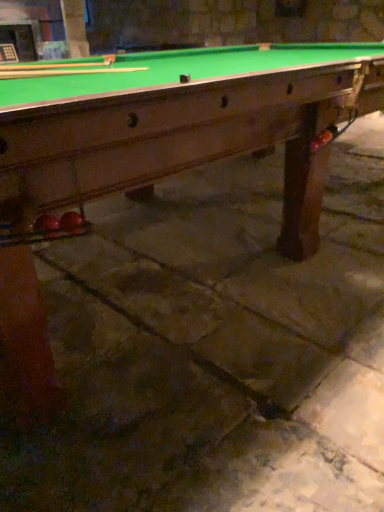
The width and height of the screenshot is (384, 512). Describe the element at coordinates (62, 71) in the screenshot. I see `wooden cue at upper left, which is counted as the 1th cue, starting from the back` at that location.

How much space does wooden cue at upper left, which is counted as the 1th cue, starting from the back, occupy horizontally?

The width of wooden cue at upper left, which is counted as the 1th cue, starting from the back, is 68.19 centimeters.

Locate an element on the screen. The image size is (384, 512). wooden cue at upper left, which is counted as the 1th cue, starting from the back is located at coordinates (62, 71).

Locate an element on the screen. The image size is (384, 512). wooden cue at upper left, arranged as the first cue when viewed from the front is located at coordinates (54, 65).

Describe the element at coordinates (54, 65) in the screenshot. This screenshot has width=384, height=512. I see `wooden cue at upper left, the 2th cue when ordered from back to front` at that location.

This screenshot has height=512, width=384. I want to click on wooden cue at upper left, which is counted as the 1th cue, starting from the back, so click(62, 71).

In the image, is wooden cue at upper left, marked as the 2th cue in a front-to-back arrangement, on the left side or the right side of wooden cue at upper left, the 2th cue when ordered from back to front?

wooden cue at upper left, marked as the 2th cue in a front-to-back arrangement, is positioned on wooden cue at upper left, the 2th cue when ordered from back to front,'s right side.

Is the depth of wooden cue at upper left, marked as the 2th cue in a front-to-back arrangement, less than that of wooden cue at upper left, arranged as the first cue when viewed from the front?

No, the depth of wooden cue at upper left, marked as the 2th cue in a front-to-back arrangement, is greater than that of wooden cue at upper left, arranged as the first cue when viewed from the front.

Which is closer, (x=76, y=71) or (x=96, y=63)?

Point (x=76, y=71)

From the image's perspective, is wooden cue at upper left, which is counted as the 1th cue, starting from the back, above or below wooden cue at upper left, arranged as the first cue when viewed from the front?

wooden cue at upper left, which is counted as the 1th cue, starting from the back, is below wooden cue at upper left, arranged as the first cue when viewed from the front.

From a real-world perspective, which is physically above, wooden cue at upper left, marked as the 2th cue in a front-to-back arrangement, or wooden cue at upper left, arranged as the first cue when viewed from the front?

In real-world perspective, wooden cue at upper left, arranged as the first cue when viewed from the front, is above.

Consider the image. Can you confirm if wooden cue at upper left, marked as the 2th cue in a front-to-back arrangement, is thinner than wooden cue at upper left, the 2th cue when ordered from back to front?

No, wooden cue at upper left, marked as the 2th cue in a front-to-back arrangement, is not thinner than wooden cue at upper left, the 2th cue when ordered from back to front.

Which of these two, wooden cue at upper left, which is counted as the 1th cue, starting from the back, or wooden cue at upper left, arranged as the first cue when viewed from the front, stands taller?

wooden cue at upper left, arranged as the first cue when viewed from the front, is taller.

Can you confirm if wooden cue at upper left, marked as the 2th cue in a front-to-back arrangement, is smaller than wooden cue at upper left, the 2th cue when ordered from back to front?

Indeed, wooden cue at upper left, marked as the 2th cue in a front-to-back arrangement, has a smaller size compared to wooden cue at upper left, the 2th cue when ordered from back to front.

Choose the correct answer: Is wooden cue at upper left, marked as the 2th cue in a front-to-back arrangement, inside wooden cue at upper left, arranged as the first cue when viewed from the front, or outside it?

The correct answer is: outside.

Is wooden cue at upper left, marked as the 2th cue in a front-to-back arrangement, directly adjacent to wooden cue at upper left, arranged as the first cue when viewed from the front?

Yes, wooden cue at upper left, marked as the 2th cue in a front-to-back arrangement, is touching wooden cue at upper left, arranged as the first cue when viewed from the front.

Is wooden cue at upper left, marked as the 2th cue in a front-to-back arrangement, oriented towards wooden cue at upper left, arranged as the first cue when viewed from the front?

No, wooden cue at upper left, marked as the 2th cue in a front-to-back arrangement, is not facing towards wooden cue at upper left, arranged as the first cue when viewed from the front.

Can you tell me how much wooden cue at upper left, which is counted as the 1th cue, starting from the back, and wooden cue at upper left, the 2th cue when ordered from back to front, differ in facing direction?

0.000514 degrees separate the facing orientations of wooden cue at upper left, which is counted as the 1th cue, starting from the back, and wooden cue at upper left, the 2th cue when ordered from back to front.

This screenshot has height=512, width=384. Identify the location of cue that is on the left side of wooden cue at upper left, which is counted as the 1th cue, starting from the back. (54, 65).

Based on the photo, which object is positioned more to the left, wooden cue at upper left, arranged as the first cue when viewed from the front, or wooden cue at upper left, which is counted as the 1th cue, starting from the back?

From the viewer's perspective, wooden cue at upper left, arranged as the first cue when viewed from the front, appears more on the left side.

Which object is closer to the camera, wooden cue at upper left, arranged as the first cue when viewed from the front, or wooden cue at upper left, which is counted as the 1th cue, starting from the back?

wooden cue at upper left, arranged as the first cue when viewed from the front, is closer to the camera.

Which is behind, point (108, 61) or point (100, 67)?

Positioned behind is point (108, 61).

Consider the image. From the image's perspective, is wooden cue at upper left, arranged as the first cue when viewed from the front, located above or below wooden cue at upper left, which is counted as the 1th cue, starting from the back?

wooden cue at upper left, arranged as the first cue when viewed from the front, is above wooden cue at upper left, which is counted as the 1th cue, starting from the back.

From a real-world perspective, is wooden cue at upper left, the 2th cue when ordered from back to front, below wooden cue at upper left, marked as the 2th cue in a front-to-back arrangement?

Actually, wooden cue at upper left, the 2th cue when ordered from back to front, is physically above wooden cue at upper left, marked as the 2th cue in a front-to-back arrangement, in the real world.

Can you confirm if wooden cue at upper left, the 2th cue when ordered from back to front, is wider than wooden cue at upper left, which is counted as the 1th cue, starting from the back?

No.

Considering the relative sizes of wooden cue at upper left, the 2th cue when ordered from back to front, and wooden cue at upper left, marked as the 2th cue in a front-to-back arrangement, in the image provided, is wooden cue at upper left, the 2th cue when ordered from back to front, taller than wooden cue at upper left, marked as the 2th cue in a front-to-back arrangement,?

Correct, wooden cue at upper left, the 2th cue when ordered from back to front, is much taller as wooden cue at upper left, marked as the 2th cue in a front-to-back arrangement.

Can you confirm if wooden cue at upper left, arranged as the first cue when viewed from the front, is bigger than wooden cue at upper left, which is counted as the 1th cue, starting from the back?

Correct, wooden cue at upper left, arranged as the first cue when viewed from the front, is larger in size than wooden cue at upper left, which is counted as the 1th cue, starting from the back.

Would you say wooden cue at upper left, arranged as the first cue when viewed from the front, contains wooden cue at upper left, marked as the 2th cue in a front-to-back arrangement?

No, wooden cue at upper left, marked as the 2th cue in a front-to-back arrangement, is located outside of wooden cue at upper left, arranged as the first cue when viewed from the front.

Is wooden cue at upper left, arranged as the first cue when viewed from the front, directly adjacent to wooden cue at upper left, which is counted as the 1th cue, starting from the back?

Absolutely, wooden cue at upper left, arranged as the first cue when viewed from the front, is next to and touching wooden cue at upper left, which is counted as the 1th cue, starting from the back.

Could you tell me if wooden cue at upper left, arranged as the first cue when viewed from the front, is facing wooden cue at upper left, which is counted as the 1th cue, starting from the back?

No, wooden cue at upper left, arranged as the first cue when viewed from the front, is not oriented towards wooden cue at upper left, which is counted as the 1th cue, starting from the back.

How many degrees apart are the facing directions of wooden cue at upper left, the 2th cue when ordered from back to front, and wooden cue at upper left, marked as the 2th cue in a front-to-back arrangement?

wooden cue at upper left, the 2th cue when ordered from back to front, and wooden cue at upper left, marked as the 2th cue in a front-to-back arrangement, are facing 0.000514 degrees away from each other.

Locate an element on the screen. cue in front of the wooden cue at upper left, which is counted as the 1th cue, starting from the back is located at coordinates (54, 65).

Locate an element on the screen. cue below the wooden cue at upper left, arranged as the first cue when viewed from the front (from a real-world perspective) is located at coordinates (62, 71).

Identify the location of cue behind the wooden cue at upper left, the 2th cue when ordered from back to front. The width and height of the screenshot is (384, 512). (62, 71).